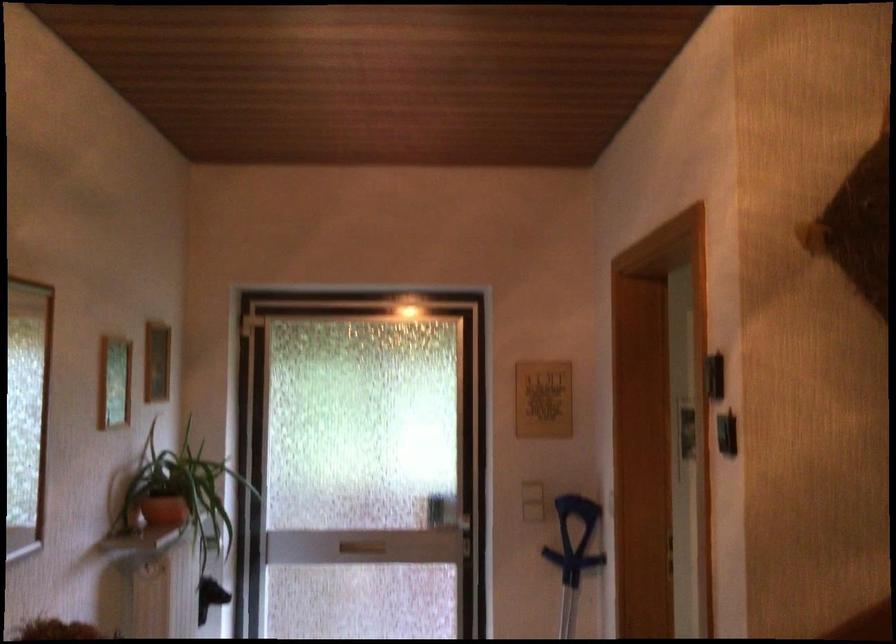
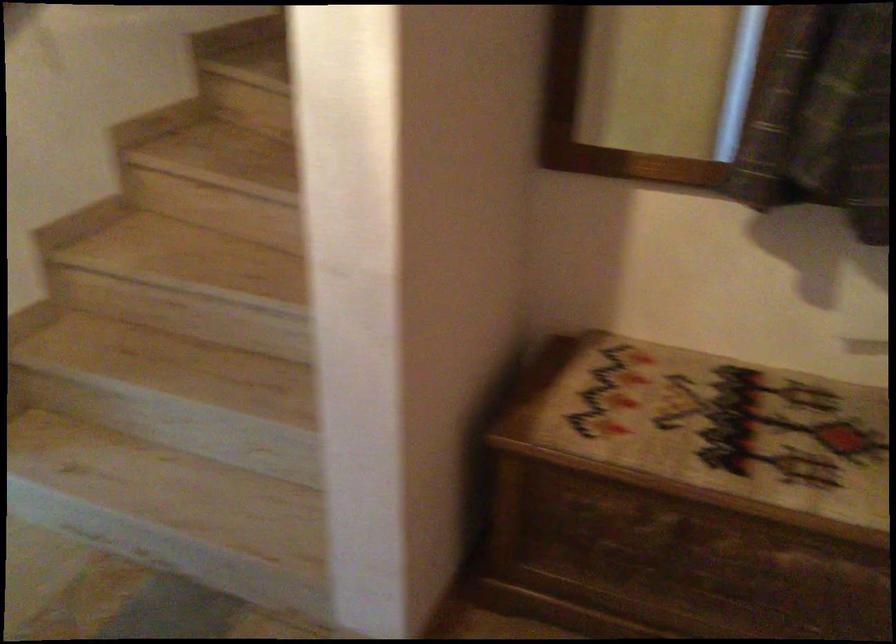
The first image is from the beginning of the video and the second image is from the end. How did the camera likely rotate when shooting the video?

The rotation direction of the camera is right-down.